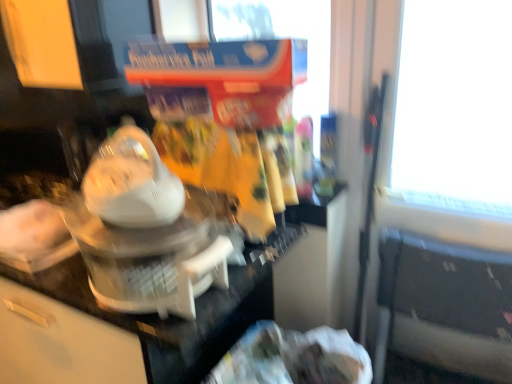
Question: Considering the relative sizes of white plastic blender at center and black plastic chair at lower right in the image provided, is white plastic blender at center thinner than black plastic chair at lower right?

Choices:
 (A) yes
 (B) no

Answer: (B)

Question: From a real-world perspective, is white plastic blender at center below black plastic chair at lower right?

Choices:
 (A) no
 (B) yes

Answer: (A)

Question: Considering the relative sizes of white plastic blender at center and black plastic chair at lower right in the image provided, is white plastic blender at center taller than black plastic chair at lower right?

Choices:
 (A) no
 (B) yes

Answer: (A)

Question: Does white plastic blender at center come in front of black plastic chair at lower right?

Choices:
 (A) yes
 (B) no

Answer: (A)

Question: From the image's perspective, is white plastic blender at center below black plastic chair at lower right?

Choices:
 (A) no
 (B) yes

Answer: (A)

Question: Does white plastic blender at center have a greater width compared to black plastic chair at lower right?

Choices:
 (A) yes
 (B) no

Answer: (A)

Question: Could you tell me if white glossy counter top at center is facing white plastic blender at center?

Choices:
 (A) no
 (B) yes

Answer: (A)

Question: Is white glossy counter top at center thinner than white plastic blender at center?

Choices:
 (A) no
 (B) yes

Answer: (A)

Question: Does white glossy counter top at center appear on the left side of white plastic blender at center?

Choices:
 (A) yes
 (B) no

Answer: (A)

Question: Would you say white glossy counter top at center contains white plastic blender at center?

Choices:
 (A) no
 (B) yes

Answer: (A)

Question: Is white glossy counter top at center facing away from white plastic blender at center?

Choices:
 (A) yes
 (B) no

Answer: (B)

Question: From a real-world perspective, does white glossy counter top at center sit lower than white plastic blender at center?

Choices:
 (A) no
 (B) yes

Answer: (B)

Question: Is black plastic chair at lower right turned away from white plastic blender at center?

Choices:
 (A) no
 (B) yes

Answer: (A)